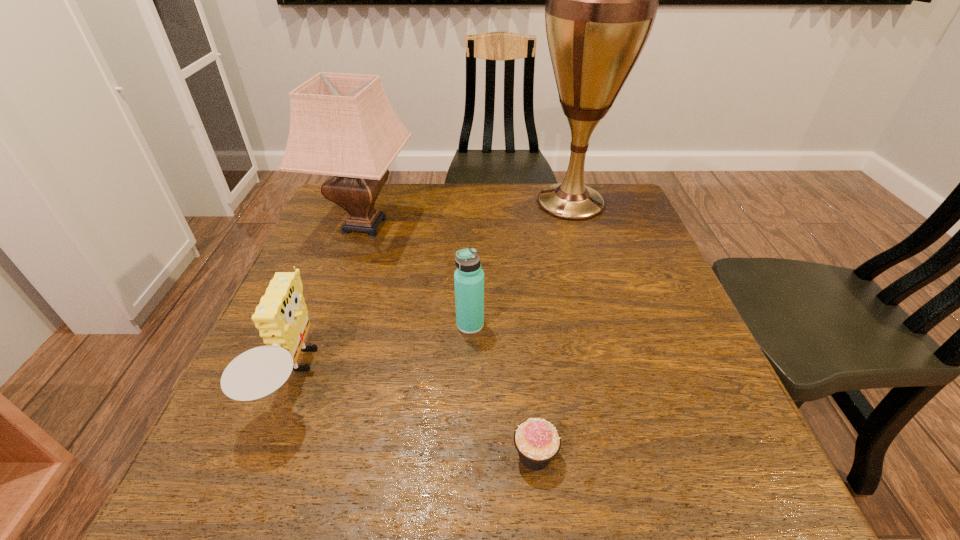
Where is `free space located 0.310m on the front-facing side of the sponge`? free space located 0.310m on the front-facing side of the sponge is located at coordinates (489, 375).

The image size is (960, 540). Find the location of `vacant space located 0.390m on the back of the fourth object from left to right`. vacant space located 0.390m on the back of the fourth object from left to right is located at coordinates (517, 280).

The image size is (960, 540). I want to click on trophy cup at the far edge, so click(x=601, y=2).

Identify the location of lampshade present at the far edge. The width and height of the screenshot is (960, 540). (342, 125).

Identify the location of object positioned at the near edge. (537, 441).

Image resolution: width=960 pixels, height=540 pixels. In order to click on lampshade at the left edge in this screenshot , I will do `click(342, 125)`.

You are a GUI agent. You are given a task and a screenshot of the screen. Output one action in this format:
    pyautogui.click(x=<x>, y=<y>)
    Task: Click on the sponge at the left edge
    
    Given the screenshot: What is the action you would take?
    pyautogui.click(x=281, y=317)

Identify the location of object that is at the right edge. This screenshot has height=540, width=960. (601, 2).

Where is `object positioned at the far left corner`? Image resolution: width=960 pixels, height=540 pixels. object positioned at the far left corner is located at coordinates (342, 125).

The width and height of the screenshot is (960, 540). I want to click on object that is at the far right corner, so click(x=601, y=2).